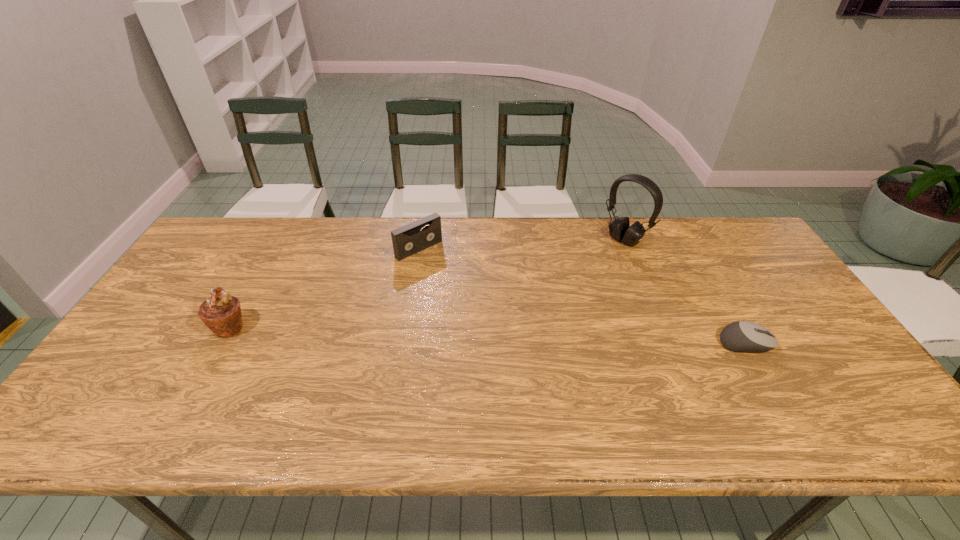
I want to click on free region located 0.240m on the front-facing side of the second shortest object, so click(479, 301).

I want to click on vacant space located on the front-facing side of the second shortest object, so click(x=444, y=270).

The width and height of the screenshot is (960, 540). What are the coordinates of `free space located on the front-facing side of the second shortest object` in the screenshot? It's located at (448, 273).

What are the coordinates of `vacant position located on the front-facing side of the headset` in the screenshot? It's located at click(x=587, y=271).

Locate an element on the screen. This screenshot has width=960, height=540. free region located on the front-facing side of the headset is located at coordinates (585, 273).

The image size is (960, 540). Find the location of `vacant space situated on the front-facing side of the headset`. vacant space situated on the front-facing side of the headset is located at coordinates (585, 273).

The height and width of the screenshot is (540, 960). Find the location of `videotape located in the far edge section of the desktop`. videotape located in the far edge section of the desktop is located at coordinates (407, 240).

Locate an element on the screen. Image resolution: width=960 pixels, height=540 pixels. headset situated at the far edge is located at coordinates click(619, 229).

Locate an element on the screen. This screenshot has width=960, height=540. object that is at the right edge is located at coordinates (743, 336).

Identify the location of free spot at the far edge of the desktop. The image size is (960, 540). (466, 224).